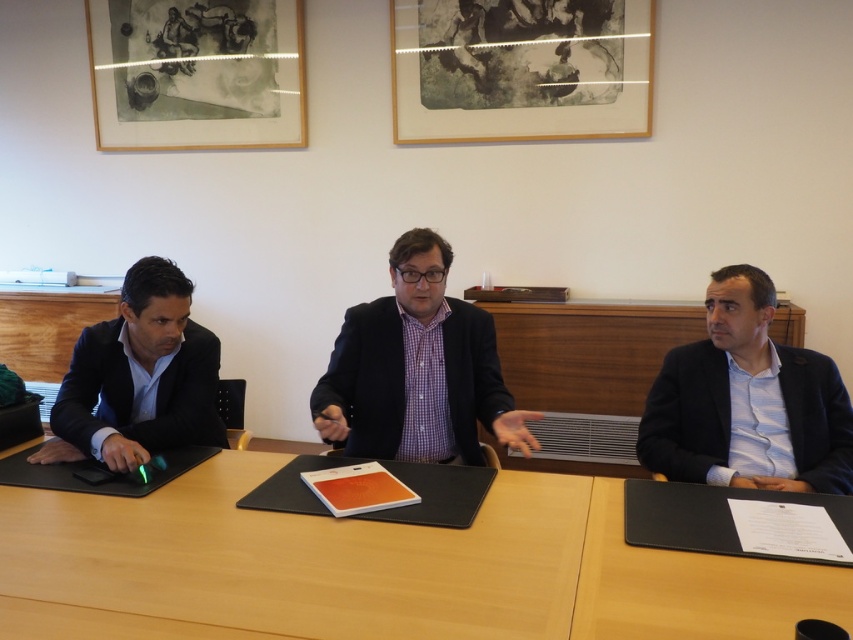
Question: Is wooden picture frame at upper center closer to camera compared to dark blue textured suit at center?

Choices:
 (A) no
 (B) yes

Answer: (A)

Question: Which point is closer to the camera taking this photo?

Choices:
 (A) (207, 428)
 (B) (543, 499)
 (C) (354, 452)

Answer: (B)

Question: Is wooden table at center behind black matte suit at right?

Choices:
 (A) no
 (B) yes

Answer: (A)

Question: Which object is the closest to the wooden table at center?

Choices:
 (A) matte black suit at left
 (B) wooden picture frame at upper center

Answer: (A)

Question: From the image, what is the correct spatial relationship of wooden table at center in relation to black matte suit at right?

Choices:
 (A) left
 (B) right

Answer: (A)

Question: Among these objects, which one is nearest to the camera?

Choices:
 (A) wooden table at center
 (B) matte black suit at left
 (C) wooden picture frame at upper center
 (D) dark blue textured suit at center

Answer: (A)